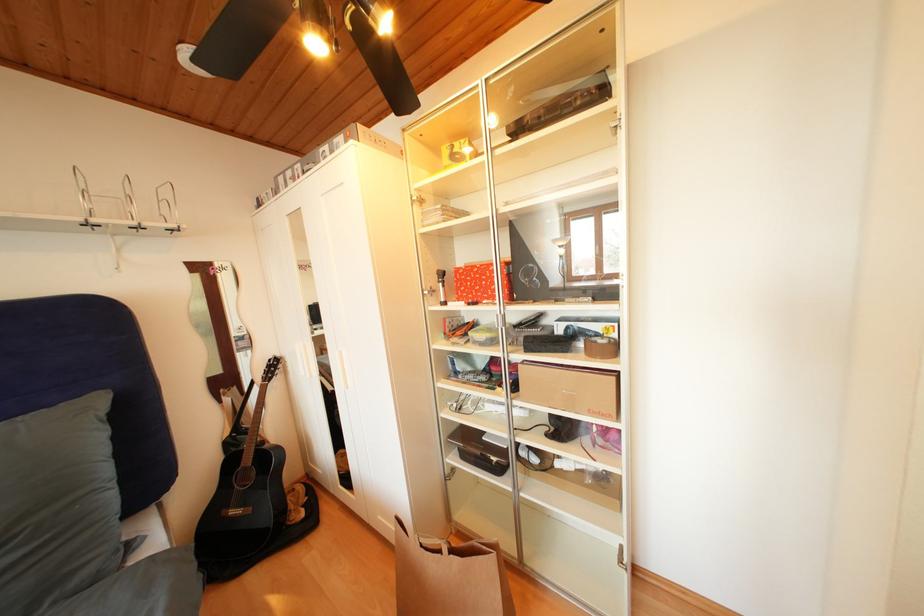
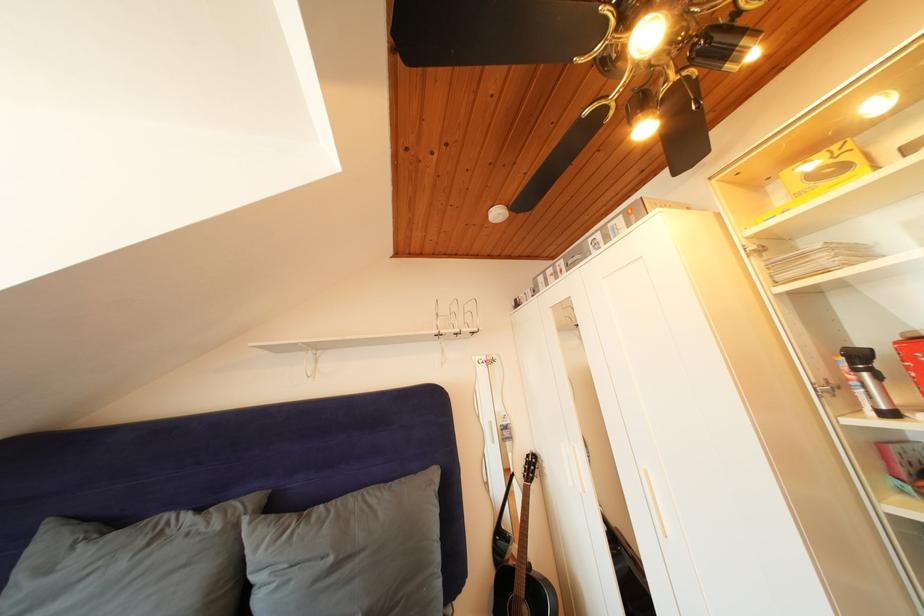
Locate, in the second image, the point that corresponds to point (256, 464) in the first image.

(528, 592)